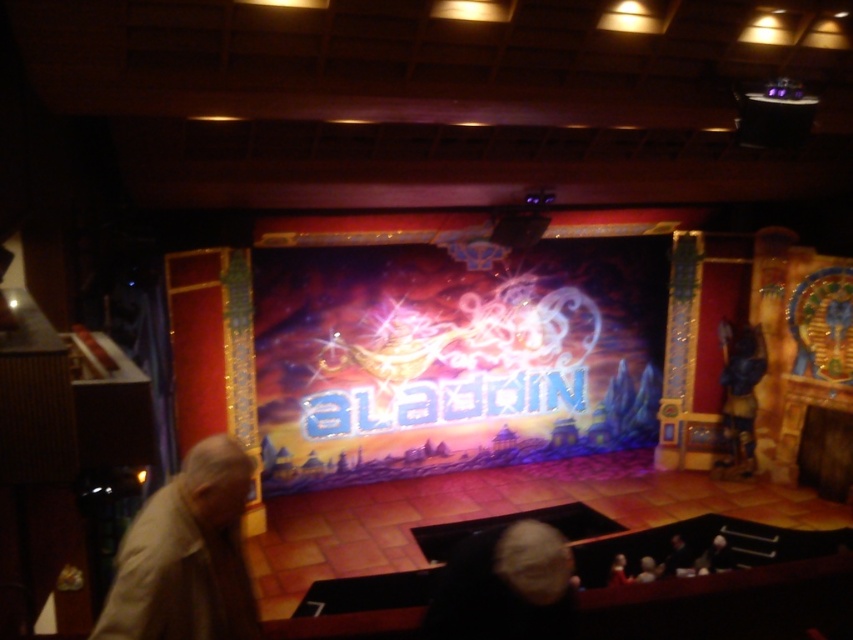
Between light beige fabric at lower left and light beige hair at lower center, which one has less height?

light beige hair at lower center

Describe the element at coordinates (186, 556) in the screenshot. The image size is (853, 640). I see `light beige fabric at lower left` at that location.

Where is `light beige fabric at lower left`? The width and height of the screenshot is (853, 640). light beige fabric at lower left is located at coordinates (186, 556).

Is light beige hair at lower center positioned in front of dark hair at center?

Yes, light beige hair at lower center is closer to the viewer.

This screenshot has height=640, width=853. Identify the location of light beige hair at lower center. (618, 572).

What are the coordinates of `light beige hair at lower center` in the screenshot? It's located at (618, 572).

Identify the location of light beige hair at lower center. The height and width of the screenshot is (640, 853). (618, 572).

Who is taller, light beige fabric at lower left or dark hair at center?

With more height is light beige fabric at lower left.

Measure the distance between light beige fabric at lower left and camera.

The distance of light beige fabric at lower left from camera is 8.62 feet.

What do you see at coordinates (186, 556) in the screenshot?
I see `light beige fabric at lower left` at bounding box center [186, 556].

You are a GUI agent. You are given a task and a screenshot of the screen. Output one action in this format:
    pyautogui.click(x=<x>, y=<y>)
    Task: Click on the light beige fabric at lower left
    This screenshot has height=640, width=853.
    Given the screenshot: What is the action you would take?
    pyautogui.click(x=186, y=556)